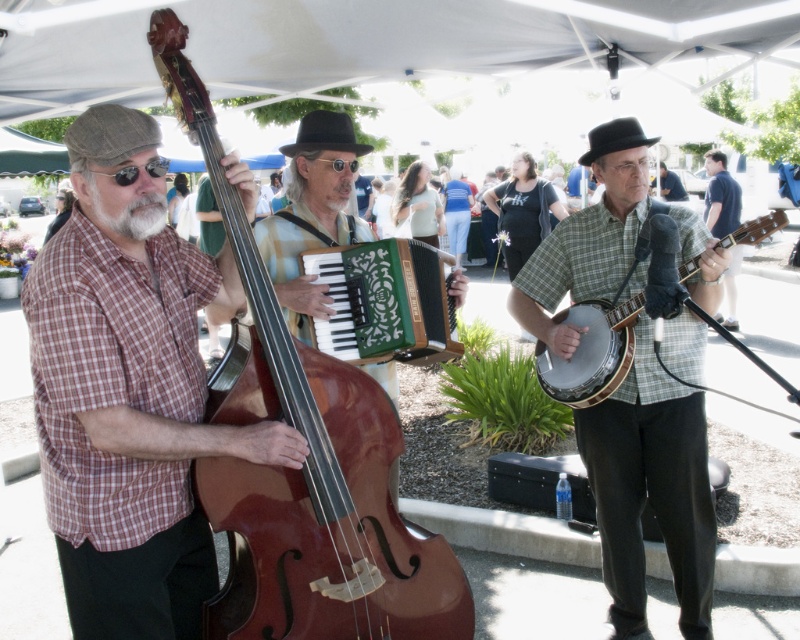
You are standing at the point marked as point (x=580, y=237) in the image. You want to walk straight towards the large white canopy. How far will you have to walk to reach the canopy?

The distance between point (x=580, y=237) and the viewer is 3.37 meters, so you will have to walk 3.37 meters to reach the canopy.

Please describe the exact location of the shiny brown wood cello at left in the image using coordinates.

The shiny brown wood cello at left is located at coordinates point (x=306, y=460).

You are standing at the center of the stage and want to hand a microphone to the musician wearing the matte plaid shirt at left. Based on their position, in which direction should you walk to reach them?

The matte plaid shirt at left is positioned at point 0.620 on the x axis and 0.163 on the y axis. Since you are at the center of the stage, you should walk towards the left and slightly forward to reach the musician wearing the matte plaid shirt at left.